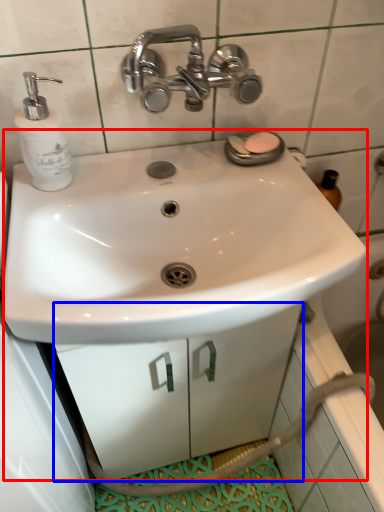
Question: Among these objects, which one is farthest to the camera, sink (highlighted by a red box) or drawer (highlighted by a blue box)?

Choices:
 (A) sink
 (B) drawer

Answer: (B)